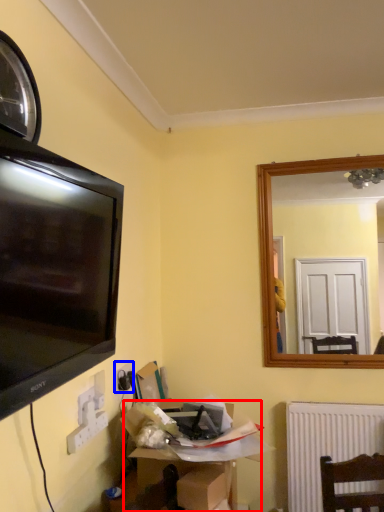
Question: Which object appears farthest to the camera in this image, cardboard box (highlighted by a red box) or electric outlet (highlighted by a blue box)?

Choices:
 (A) cardboard box
 (B) electric outlet

Answer: (B)